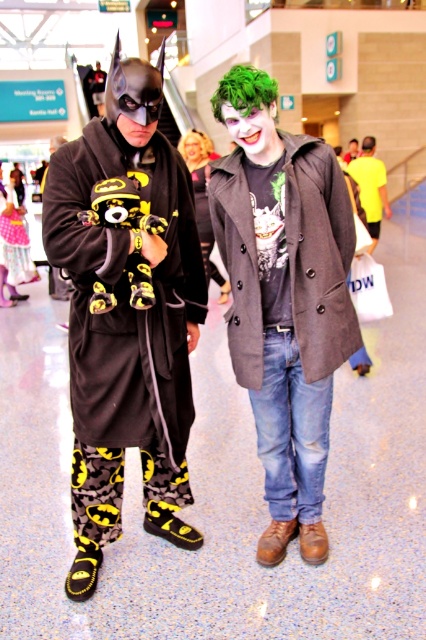
Question: Which of the following is the farthest from the observer?

Choices:
 (A) (362, 141)
 (B) (152, 268)
 (C) (333, 202)

Answer: (A)

Question: Can you confirm if batman costume at center is positioned above green matte wig at center?

Choices:
 (A) yes
 (B) no

Answer: (B)

Question: Based on their relative distances, which object is nearer to the batman costume at center?

Choices:
 (A) denim jeans at center
 (B) yellow t-shirt at right
 (C) yellowplush toy at left

Answer: (A)

Question: Which of the following is the farthest from the observer?

Choices:
 (A) (6, 237)
 (B) (376, 157)
 (C) (267, 424)

Answer: (B)

Question: Is batman costume at center wider than yellowplush toy at left?

Choices:
 (A) no
 (B) yes

Answer: (B)

Question: Does green matte wig at center have a larger size compared to yellow t-shirt at right?

Choices:
 (A) yes
 (B) no

Answer: (B)